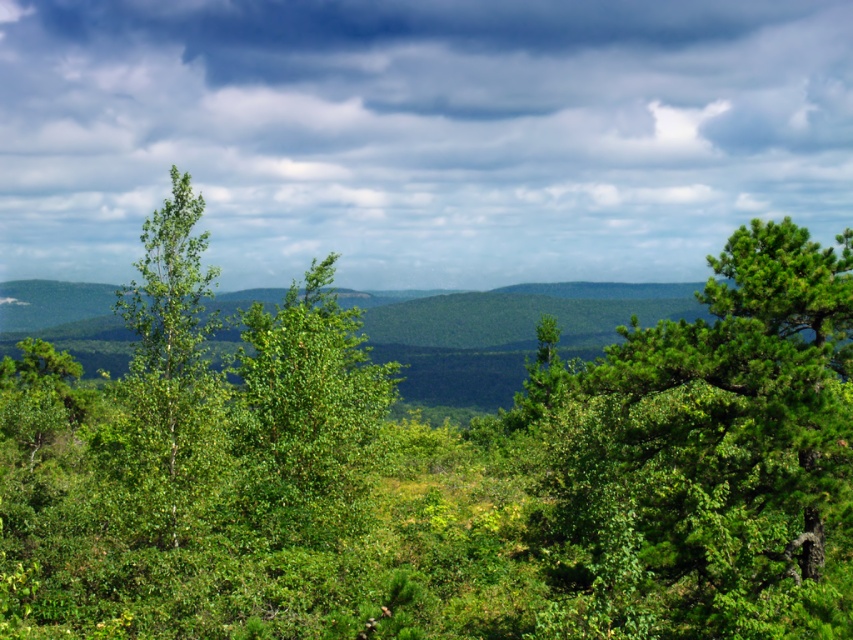
In the scene shown: Is cloudy sky at upper center further to the viewer compared to green leafy tree at center?

That is True.

Consider the image. Which of these two, cloudy sky at upper center or green leafy tree at center, stands taller?

Standing taller between the two is cloudy sky at upper center.

The image size is (853, 640). What are the coordinates of `cloudy sky at upper center` in the screenshot? It's located at (421, 134).

Who is lower down, cloudy sky at upper center or green matte tree at center?

green matte tree at center is lower down.

Does cloudy sky at upper center come behind green matte tree at center?

Yes, it is.

Who is more distant from viewer, (224, 115) or (152, 474)?

Positioned behind is point (224, 115).

Where is `cloudy sky at upper center`? The image size is (853, 640). cloudy sky at upper center is located at coordinates (421, 134).

Measure the distance from green leafy tree at center to green matte tree at center.

A distance of 18.28 feet exists between green leafy tree at center and green matte tree at center.

Is green leafy tree at center to the left of green matte tree at center from the viewer's perspective?

In fact, green leafy tree at center is to the right of green matte tree at center.

Is point (331, 362) positioned in front of point (166, 536)?

No, (331, 362) is further to viewer.

Locate an element on the screen. The height and width of the screenshot is (640, 853). green leafy tree at center is located at coordinates (306, 416).